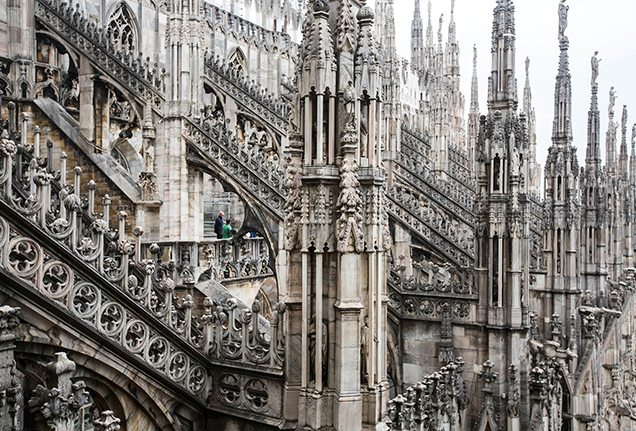
Identify the location of stairway. (284, 110).